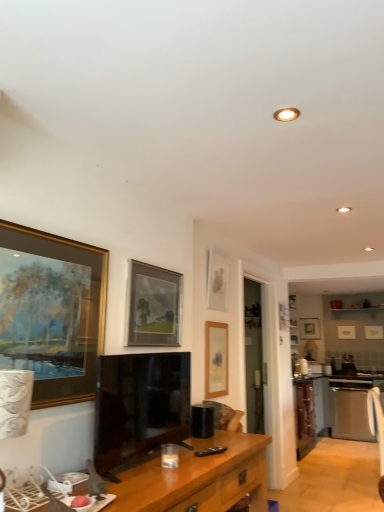
The height and width of the screenshot is (512, 384). Find the location of `matte black tv at center`. matte black tv at center is located at coordinates (140, 405).

Measure the distance between matte gold picture frame at upper right, acting as the 3th picture frame starting from the back, and camera.

matte gold picture frame at upper right, acting as the 3th picture frame starting from the back, and camera are 5.95 meters apart from each other.

How much space does matte gold picture frame at upper right, acting as the sixth picture frame starting from the front, occupy horizontally?

matte gold picture frame at upper right, acting as the sixth picture frame starting from the front, is 4.01 centimeters wide.

Describe the element at coordinates (198, 478) in the screenshot. Image resolution: width=384 pixels, height=512 pixels. I see `wooden desk at lower center` at that location.

What do you see at coordinates (309, 328) in the screenshot?
I see `matte gold picture frame at center, the fifth picture frame in the left-to-right sequence` at bounding box center [309, 328].

Image resolution: width=384 pixels, height=512 pixels. Identify the location of wooden picture frame at center, arranged as the 3th picture frame when viewed from the front. (216, 359).

Where is `matte black tv at center`? Image resolution: width=384 pixels, height=512 pixels. matte black tv at center is located at coordinates (140, 405).

Which is correct: white glossy microwave at right, placed as the second appliance when sorted from front to back, is inside wooden desk at lower center, or outside of it?

white glossy microwave at right, placed as the second appliance when sorted from front to back, is not enclosed by wooden desk at lower center.

From the image's perspective, is white glossy microwave at right, the 1th appliance positioned from the back, over wooden desk at lower center?

No.

Are white glossy microwave at right, the 2th appliance positioned from the left, and wooden desk at lower center making contact?

No, white glossy microwave at right, the 2th appliance positioned from the left, is not next to wooden desk at lower center.

From the picture: Looking at their sizes, would you say white glossy microwave at right, arranged as the 1th appliance when viewed from the right, is wider or thinner than wooden desk at lower center?

white glossy microwave at right, arranged as the 1th appliance when viewed from the right, is thinner than wooden desk at lower center.

How much distance is there between stainless steel oven at right and wooden desk at lower center?

stainless steel oven at right is 4.38 meters away from wooden desk at lower center.

Does stainless steel oven at right turn towards wooden desk at lower center?

Yes, stainless steel oven at right is turned towards wooden desk at lower center.

Considering the relative positions of stainless steel oven at right and wooden desk at lower center in the image provided, is stainless steel oven at right to the left of wooden desk at lower center from the viewer's perspective?

No.

How many degrees apart are the facing directions of stainless steel oven at right and wooden desk at lower center?

There is a 88-degree angle between the facing directions of stainless steel oven at right and wooden desk at lower center.

Does point (211, 358) come farther from viewer compared to point (166, 509)?

That is True.

From a real-world perspective, does wooden picture frame at center, which ranks as the 5th picture frame in right-to-left order, sit lower than wooden desk at lower center?

No.

Relative to wooden desk at lower center, is wooden picture frame at center, which ranks as the 5th picture frame in right-to-left order, in front or behind?

Visually, wooden picture frame at center, which ranks as the 5th picture frame in right-to-left order, is located behind wooden desk at lower center.

Looking at this image, is matte wooden picture frame at upper center, the 4th picture frame in the left-to-right sequence, at the right side of matte glass picture frame at upper center, positioned as the 6th picture frame in right-to-left order?

Yes.

Considering the relative sizes of matte wooden picture frame at upper center, which is the 4th picture frame in front-to-back order, and matte glass picture frame at upper center, which is counted as the 2th picture frame, starting from the left, in the image provided, is matte wooden picture frame at upper center, which is the 4th picture frame in front-to-back order, bigger than matte glass picture frame at upper center, which is counted as the 2th picture frame, starting from the left,?

No, matte wooden picture frame at upper center, which is the 4th picture frame in front-to-back order, is not bigger than matte glass picture frame at upper center, which is counted as the 2th picture frame, starting from the left.

From a real-world perspective, is matte wooden picture frame at upper center, which is the 4th picture frame in front-to-back order, positioned over matte glass picture frame at upper center, which is the 2th picture frame from front to back, based on gravity?

Yes, from a real-world perspective, matte wooden picture frame at upper center, which is the 4th picture frame in front-to-back order, is over matte glass picture frame at upper center, which is the 2th picture frame from front to back

How much distance is there between matte wooden picture frame at upper center, which is the 4th picture frame in back-to-front order, and matte glass picture frame at upper center, which is the sixth picture frame from back to front?

They are 29.97 inches apart.

Is the depth of matte black tv at center greater than that of matte gold picture frame at upper right, acting as the second picture frame starting from the right?

That is False.

From a real-world perspective, is matte black tv at center under matte gold picture frame at upper right, the 2th picture frame when ordered from back to front?

Yes, from a real-world perspective, matte black tv at center is beneath matte gold picture frame at upper right, the 2th picture frame when ordered from back to front.

Which of these two, matte black tv at center or matte gold picture frame at upper right, acting as the second picture frame starting from the right, is thinner?

With smaller width is matte gold picture frame at upper right, acting as the second picture frame starting from the right.

At what (x,y) coordinates should I click in order to perform the action: click on picture frame that is the 5th one when counting rightward from the matte black tv at center. Please return your answer as a coordinate pair (x, y). Looking at the image, I should click on (346, 332).

Looking at this image, from a real-world perspective, is wooden desk at lower center on matte glass picture frame at upper center, which is the 2th picture frame from front to back?

No, from a real-world perspective, wooden desk at lower center is not over matte glass picture frame at upper center, which is the 2th picture frame from front to back

Is wooden desk at lower center facing towards matte glass picture frame at upper center, which is counted as the 2th picture frame, starting from the left?

No.

From the picture: Can you confirm if wooden desk at lower center is smaller than matte glass picture frame at upper center, which is the sixth picture frame from back to front?

No, wooden desk at lower center is not smaller than matte glass picture frame at upper center, which is the sixth picture frame from back to front.

Is point (201, 510) more distant than point (172, 271)?

No, (201, 510) is closer to viewer.

Is gold-framed painting at left, which is the 1th picture frame from left to right, positioned behind matte wooden picture frame at upper center, which is the 4th picture frame in back-to-front order?

No, the depth of gold-framed painting at left, which is the 1th picture frame from left to right, is less than that of matte wooden picture frame at upper center, which is the 4th picture frame in back-to-front order.

Does gold-framed painting at left, which is the 1th picture frame from left to right, touch matte wooden picture frame at upper center, the 4th picture frame in the left-to-right sequence?

gold-framed painting at left, which is the 1th picture frame from left to right, is not next to matte wooden picture frame at upper center, the 4th picture frame in the left-to-right sequence, and they're not touching.

Considering the sizes of gold-framed painting at left, the 7th picture frame when ordered from right to left, and matte wooden picture frame at upper center, which is the 4th picture frame in front-to-back order, in the image, is gold-framed painting at left, the 7th picture frame when ordered from right to left, taller or shorter than matte wooden picture frame at upper center, which is the 4th picture frame in front-to-back order,?

Clearly, gold-framed painting at left, the 7th picture frame when ordered from right to left, is taller compared to matte wooden picture frame at upper center, which is the 4th picture frame in front-to-back order.

Where is `appliance that is the 2nd object located behind the wooden desk at lower center`? This screenshot has height=512, width=384. appliance that is the 2nd object located behind the wooden desk at lower center is located at coordinates (302, 367).

Find the location of a particular element. Image resolution: width=384 pixels, height=512 pixels. desk that appears in front of the stainless steel oven at right is located at coordinates (198, 478).

From the image, which object appears to be farther from white glossy microwave at right, the 2th appliance positioned from the left, matte glass picture frame at upper center, which is the sixth picture frame from back to front, or wooden picture frame at center, arranged as the 3th picture frame when viewed from the front?

Based on the image, matte glass picture frame at upper center, which is the sixth picture frame from back to front, appears to be further to white glossy microwave at right, the 2th appliance positioned from the left.

Looking at the image, which one is located closer to matte gold picture frame at upper right, acting as the 3th picture frame starting from the back, stainless steel oven at right or matte wooden picture frame at upper center, which ranks as the 4th picture frame in right-to-left order?

stainless steel oven at right.

Based on their spatial positions, is matte gold picture frame at center, marked as the 7th picture frame in a front-to-back arrangement, or matte glass picture frame at upper center, positioned as the 6th picture frame in right-to-left order, further from wooden desk at lower center?

matte gold picture frame at center, marked as the 7th picture frame in a front-to-back arrangement, lies further to wooden desk at lower center than the other object.

Looking at the image, which one is located further to matte gold picture frame at upper right, which appears as the seventh picture frame when viewed from the left, white glossy microwave at right, the 1th appliance positioned from the back, or matte glass picture frame at upper center, which is the 2th picture frame from front to back?

Based on the image, matte glass picture frame at upper center, which is the 2th picture frame from front to back, appears to be further to matte gold picture frame at upper right, which appears as the seventh picture frame when viewed from the left.

From the image, which object appears to be nearer to matte glass picture frame at upper center, which is the 2th picture frame from front to back, wooden desk at lower center or black matte speaker at center, placed as the first appliance when sorted from top to bottom?

black matte speaker at center, placed as the first appliance when sorted from top to bottom, lies closer to matte glass picture frame at upper center, which is the 2th picture frame from front to back, than the other object.

Looking at the image, which one is located closer to wooden picture frame at center, acting as the third picture frame starting from the left, matte gold picture frame at upper right, the 1th picture frame in the right-to-left sequence, or black matte speaker at center, placed as the first appliance when sorted from top to bottom?

Among the two, black matte speaker at center, placed as the first appliance when sorted from top to bottom, is located nearer to wooden picture frame at center, acting as the third picture frame starting from the left.

Which object lies further to the anchor point stainless steel oven at right, white glossy microwave at right, which is counted as the 2th appliance, starting from the top, or black matte speaker at center, which appears as the first appliance when viewed from the left?

Based on the image, black matte speaker at center, which appears as the first appliance when viewed from the left, appears to be further to stainless steel oven at right.

Looking at the image, which one is located further to matte gold picture frame at upper right, acting as the second picture frame starting from the right, gold-framed painting at left, the 7th picture frame when ordered from right to left, or matte gold picture frame at center, which appears as the third picture frame when viewed from the right?

gold-framed painting at left, the 7th picture frame when ordered from right to left.

Locate an element on the screen. Image resolution: width=384 pixels, height=512 pixels. oven between matte glass picture frame at upper center, positioned as the 6th picture frame in right-to-left order, and matte gold picture frame at center, which appears as the third picture frame when viewed from the right, in the front-back direction is located at coordinates (351, 408).

Find the location of a particular element. appliance positioned between black matte speaker at center, placed as the 2th appliance when sorted from right to left, and matte gold picture frame at upper right, the fifth picture frame viewed from the front, from near to far is located at coordinates (302, 367).

Find the location of a particular element. Image resolution: width=384 pixels, height=512 pixels. oven between wooden desk at lower center and matte gold picture frame at upper right, which appears as the sixth picture frame when viewed from the left, in the front-back direction is located at coordinates (351, 408).

The height and width of the screenshot is (512, 384). I want to click on appliance between wooden desk at lower center and wooden picture frame at center, which ranks as the fifth picture frame in back-to-front order, in the front-back direction, so click(202, 420).